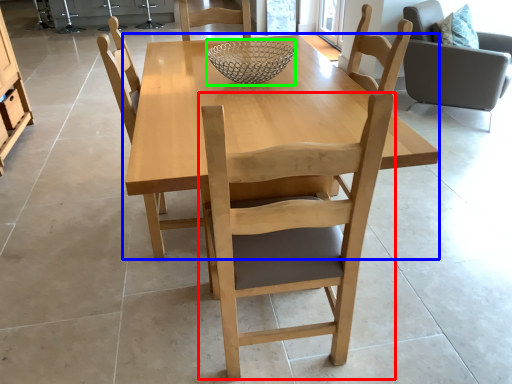
Question: Estimate the real-world distances between objects in this image. Which object is farther from chair (highlighted by a red box), kitchen & dining room table (highlighted by a blue box) or glass bowl (highlighted by a green box)?

Choices:
 (A) kitchen & dining room table
 (B) glass bowl

Answer: (B)